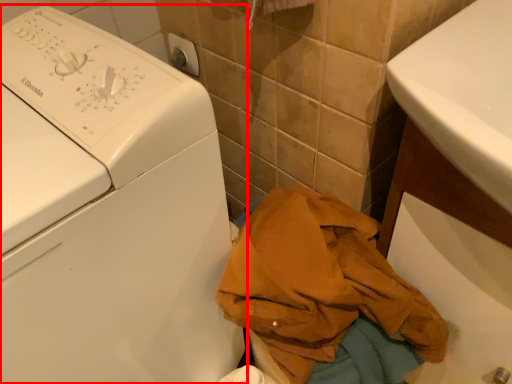
Question: Where is washing machine (annotated by the red box) located in relation to clothing in the image?

Choices:
 (A) right
 (B) left

Answer: (B)